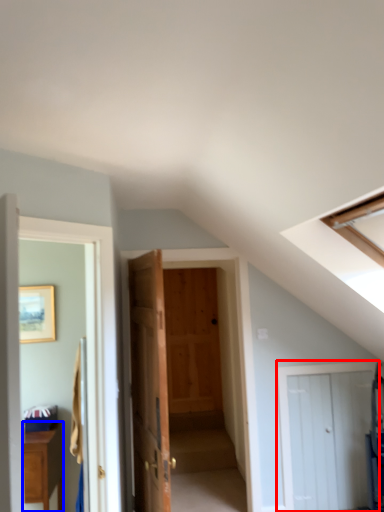
Question: Which of the following is the farthest to the observer, door (highlighted by a red box) or cabinetry (highlighted by a blue box)?

Choices:
 (A) door
 (B) cabinetry

Answer: (A)